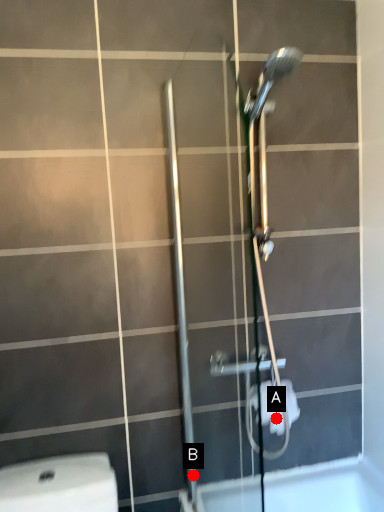
Question: Two points are circled on the image, labeled by A and B beside each circle. Which of the following is the closest to the observer?

Choices:
 (A) A is closer
 (B) B is closer

Answer: (A)